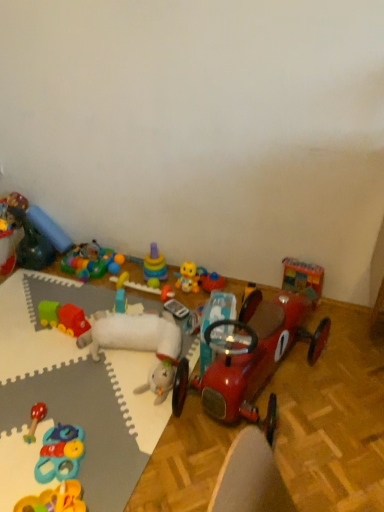
Locate an element on the screen. The width and height of the screenshot is (384, 512). vacant area located to the right-hand side of rubberized plastic toy at lower left, marked as the sixth toy in a right-to-left arrangement is located at coordinates (121, 453).